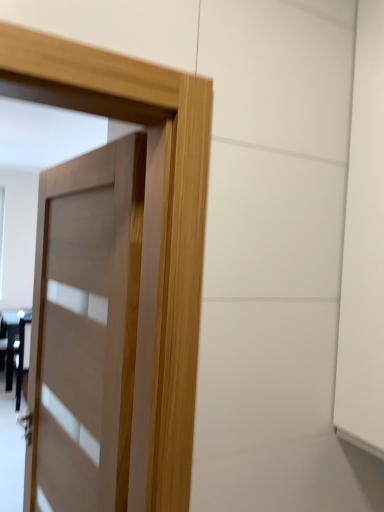
I want to click on matte black table at lower left, so click(10, 342).

The image size is (384, 512). Describe the element at coordinates (10, 342) in the screenshot. I see `matte black table at lower left` at that location.

Locate an element on the screen. Image resolution: width=384 pixels, height=512 pixels. matte wood door at center is located at coordinates (118, 294).

What do you see at coordinates (118, 294) in the screenshot? I see `matte wood door at center` at bounding box center [118, 294].

Image resolution: width=384 pixels, height=512 pixels. I want to click on matte black table at lower left, so click(x=10, y=342).

Considering the relative positions of matte black table at lower left and matte wood door at center in the image provided, is matte black table at lower left to the left or to the right of matte wood door at center?

Clearly, matte black table at lower left is on the left of matte wood door at center in the image.

Which object is closer to the camera taking this photo, matte black table at lower left or matte wood door at center?

matte wood door at center.

Is point (17, 325) closer or farther from the camera than point (171, 300)?

Point (17, 325) is positioned farther from the camera compared to point (171, 300).

From the image's perspective, is matte black table at lower left above or below matte wood door at center?

Clearly, from the image's perspective, matte black table at lower left is below matte wood door at center.

From a real-world perspective, who is located higher, matte black table at lower left or matte wood door at center?

matte wood door at center is physically above.

Between matte black table at lower left and matte wood door at center, which one has smaller width?

matte wood door at center.

Is matte black table at lower left taller than matte wood door at center?

No, matte black table at lower left is not taller than matte wood door at center.

Is matte black table at lower left smaller than matte wood door at center?

No, matte black table at lower left is not smaller than matte wood door at center.

Is matte black table at lower left positioned beyond the bounds of matte wood door at center?

That's correct, matte black table at lower left is outside of matte wood door at center.

Can you see matte black table at lower left touching matte wood door at center?

No, matte black table at lower left is not with matte wood door at center.

Is matte black table at lower left facing towards matte wood door at center?

Yes, matte black table at lower left is oriented towards matte wood door at center.

How different are the orientations of matte black table at lower left and matte wood door at center in degrees?

The angular difference between matte black table at lower left and matte wood door at center is 87.8 degrees.

The width and height of the screenshot is (384, 512). I want to click on door that is above the matte black table at lower left (from the image's perspective), so click(x=118, y=294).

Is matte wood door at center at the left side of matte black table at lower left?

In fact, matte wood door at center is to the right of matte black table at lower left.

Based on the photo, is the position of matte wood door at center more distant than that of matte black table at lower left?

→ No.

Does point (82, 289) lie behind point (7, 351)?

No, (82, 289) is in front of (7, 351).

From the image's perspective, does matte wood door at center appear higher than matte black table at lower left?

Yes.

From a real-world perspective, does matte wood door at center sit lower than matte black table at lower left?

Actually, matte wood door at center is physically above matte black table at lower left in the real world.

Which of these two, matte wood door at center or matte black table at lower left, is wider?

matte black table at lower left.

Does matte wood door at center have a lesser height compared to matte black table at lower left?

No, matte wood door at center is not shorter than matte black table at lower left.

Considering the relative sizes of matte wood door at center and matte black table at lower left in the image provided, is matte wood door at center smaller than matte black table at lower left?

Indeed, matte wood door at center has a smaller size compared to matte black table at lower left.

Consider the image. Is matte black table at lower left located within matte wood door at center?

No, matte wood door at center does not contain matte black table at lower left.

Does matte wood door at center touch matte black table at lower left?

matte wood door at center is not next to matte black table at lower left, and they're not touching.

Is matte wood door at center turned away from matte black table at lower left?

No, matte black table at lower left is not at the back of matte wood door at center.

Can you tell me how much matte wood door at center and matte black table at lower left differ in facing direction?

87.8 degrees.

Where is `door above the matte black table at lower left (from the image's perspective)`? The width and height of the screenshot is (384, 512). door above the matte black table at lower left (from the image's perspective) is located at coordinates (118, 294).

In order to click on table on the left of matte wood door at center in this screenshot , I will do `click(10, 342)`.

There is a matte black table at lower left. Identify the location of door above it (from a real-world perspective). (118, 294).